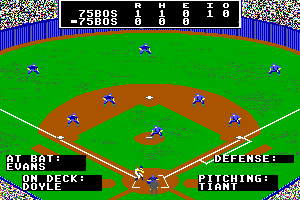
The image size is (300, 200). In order to click on pitcher in this screenshot , I will do `click(156, 130)`.